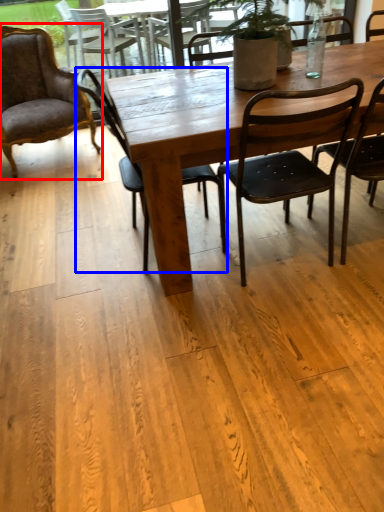
Question: Which object is closer to the camera taking this photo, chair (highlighted by a red box) or chair (highlighted by a blue box)?

Choices:
 (A) chair
 (B) chair

Answer: (B)